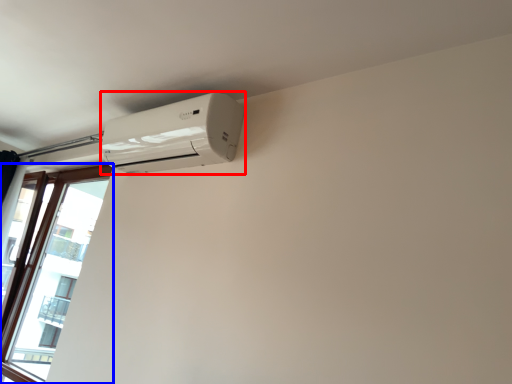
Question: Which object appears farthest to the camera in this image, home appliance (highlighted by a red box) or window (highlighted by a blue box)?

Choices:
 (A) home appliance
 (B) window

Answer: (B)